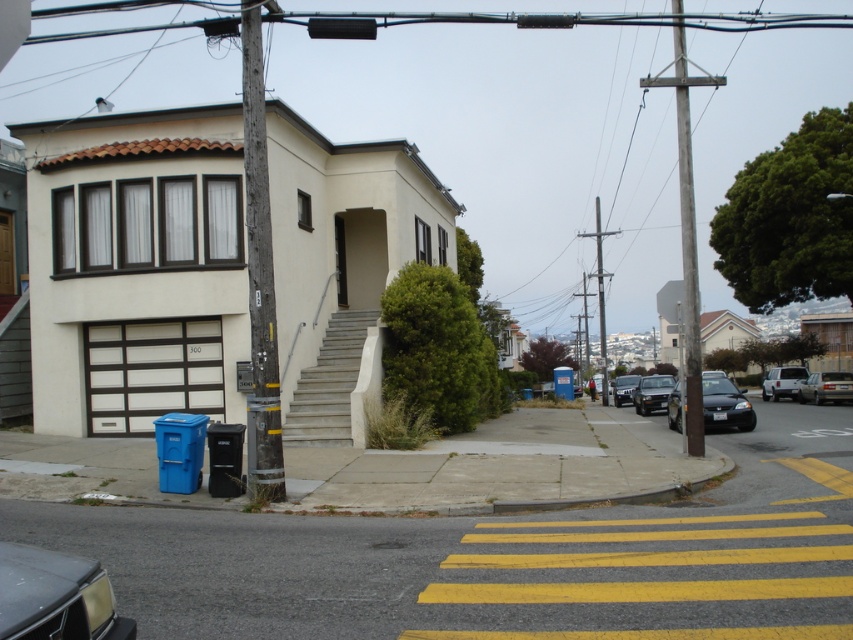
Question: Does black matte traffic light at upper center have a smaller size compared to shiny silver sedan at center-right?

Choices:
 (A) no
 (B) yes

Answer: (A)

Question: Which object appears closest to the camera in this image?

Choices:
 (A) weathered wood pole at left
 (B) shiny black car at lower left

Answer: (B)

Question: Is weathered wood pole at left positioned at the back of white matte van at right?

Choices:
 (A) no
 (B) yes

Answer: (A)

Question: Estimate the real-world distances between objects in this image. Which object is farther from the shiny black sedan at center-right?

Choices:
 (A) concrete/steps at center
 (B) gray metallic pole at upper right

Answer: (B)

Question: Observing the image, what is the correct spatial positioning of shiny black car at lower left in reference to silver metallic sedan at lower right?

Choices:
 (A) left
 (B) right

Answer: (A)

Question: Considering the real-world distances, which object is closest to the silver metallic sedan at lower right?

Choices:
 (A) weathered wood pole at left
 (B) shiny black car at lower left
 (C) white matte van at right

Answer: (C)